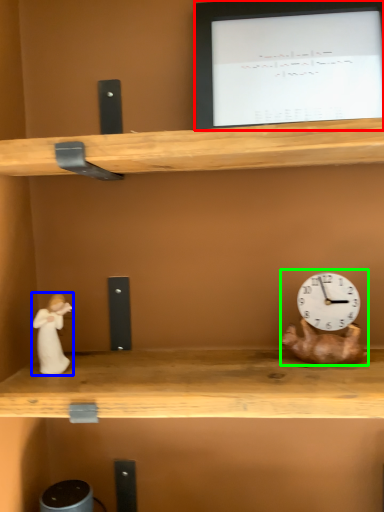
Question: Which object is the farthest from computer monitor (highlighted by a red box)? Choose among these: couple (highlighted by a blue box) or toy (highlighted by a green box).

Choices:
 (A) couple
 (B) toy

Answer: (A)